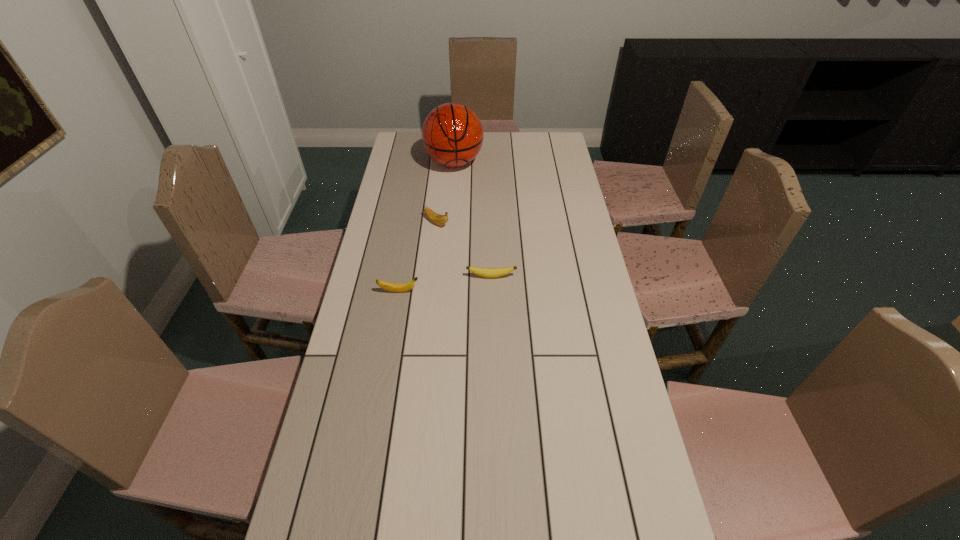
At what (x,y) coordinates should I click in order to perform the action: click on vacant space in between the second farthest object and the farthest object. Please return your answer as a coordinate pair (x, y). Looking at the image, I should click on (445, 192).

The width and height of the screenshot is (960, 540). Identify the location of vacant point located between the nearest banana and the second farthest banana. coord(445,284).

You are a GUI agent. You are given a task and a screenshot of the screen. Output one action in this format:
    pyautogui.click(x=<x>, y=<y>)
    Task: Click on the free space between the second farthest banana and the farthest banana
    The width and height of the screenshot is (960, 540).
    Given the screenshot: What is the action you would take?
    pyautogui.click(x=464, y=249)

I want to click on empty space that is in between the nearest banana and the rightmost banana, so click(x=445, y=284).

This screenshot has width=960, height=540. Identify the location of empty space between the nearest object and the third farthest object. (445, 284).

This screenshot has width=960, height=540. I want to click on vacant region between the farthest banana and the basketball, so click(x=445, y=192).

Where is `vacant space in between the second nearest banana and the farthest banana`? The height and width of the screenshot is (540, 960). vacant space in between the second nearest banana and the farthest banana is located at coordinates (464, 249).

Where is `vacant point located between the farthest object and the farthest banana`? The height and width of the screenshot is (540, 960). vacant point located between the farthest object and the farthest banana is located at coordinates (445, 192).

Select which object is the second closest to the nearest banana. Please provide its 2D coordinates. Your answer should be formatted as a tuple, i.e. [(x, y)], where the tuple contains the x and y coordinates of a point satisfying the conditions above.

[(438, 219)]

Point out which object is positioned as the second nearest to the third nearest object. Please provide its 2D coordinates. Your answer should be formatted as a tuple, i.e. [(x, y)], where the tuple contains the x and y coordinates of a point satisfying the conditions above.

[(452, 134)]